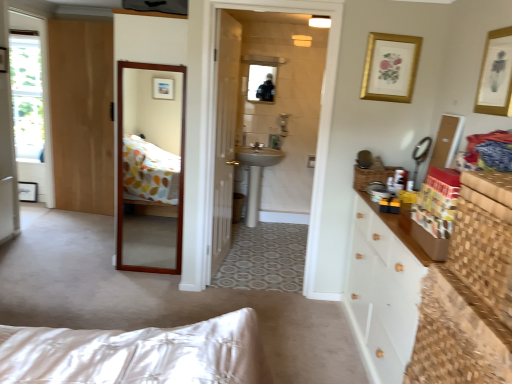
What are the coordinates of `vacant area located to the right-hand side of translucent glass door at center, the second door when ordered from back to front` in the screenshot? It's located at (259, 273).